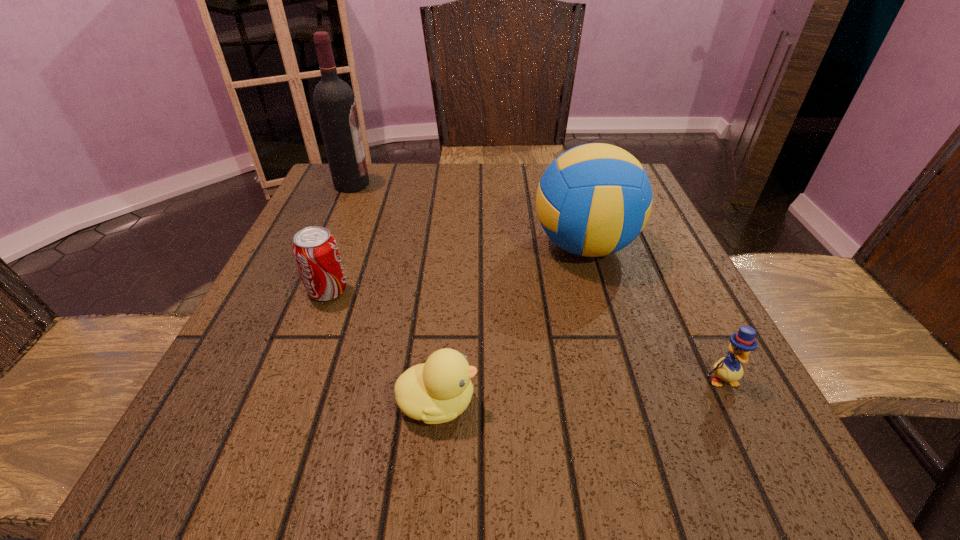
Image resolution: width=960 pixels, height=540 pixels. What are the coordinates of `free space that satisfies the following two spatial constraints: 1. on the face of the right duckling, where the monocle is placed; 2. at the beak of the third object from right to left` in the screenshot? It's located at (732, 402).

Where is `free region that satisfies the following two spatial constraints: 1. on the back side of the soda; 2. on the right side of the second tallest object`? Image resolution: width=960 pixels, height=540 pixels. free region that satisfies the following two spatial constraints: 1. on the back side of the soda; 2. on the right side of the second tallest object is located at coordinates (345, 246).

This screenshot has height=540, width=960. In order to click on vacant space that satisfies the following two spatial constraints: 1. on the back side of the soda; 2. on the label of the wine bottle in this screenshot , I will do `click(369, 185)`.